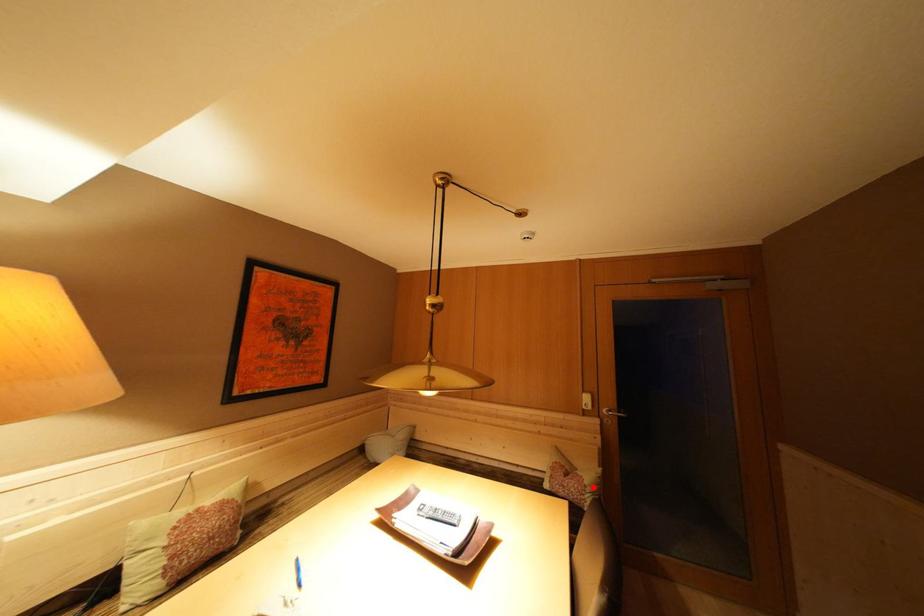
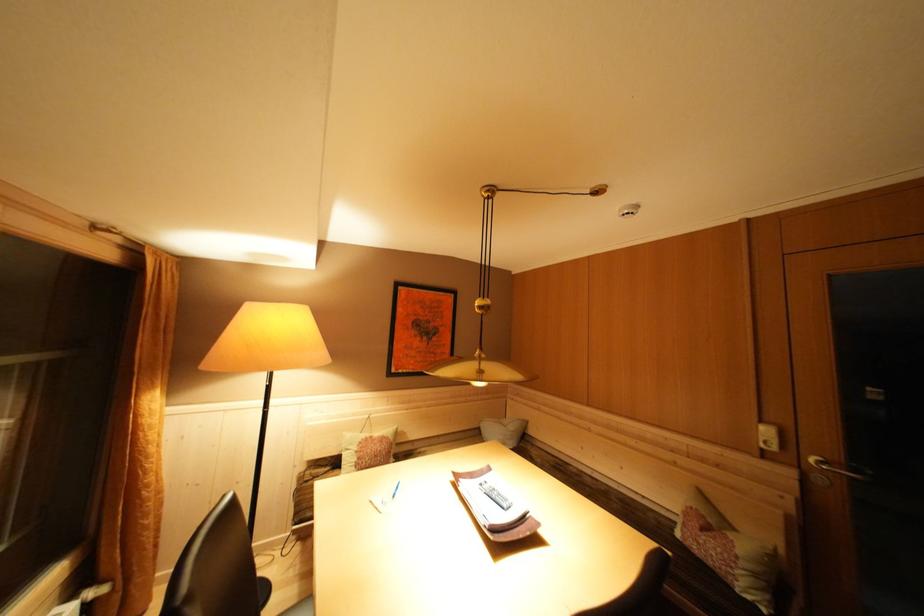
The point at the highlighted location is marked in the first image. Where is the corresponding point in the second image?

(746, 557)